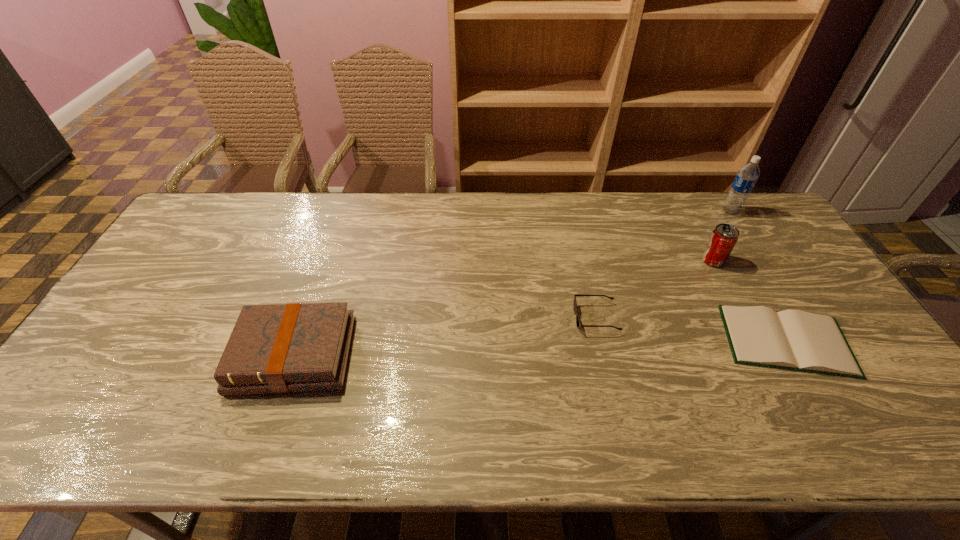
Where is `free area in between the right hardback book and the left hardback book`? free area in between the right hardback book and the left hardback book is located at coordinates [540, 348].

I want to click on empty space between the fourth tallest object and the water bottle, so click(x=663, y=265).

Where is `empty location between the leftmost object and the farthest object`? This screenshot has width=960, height=540. empty location between the leftmost object and the farthest object is located at coordinates (513, 283).

This screenshot has height=540, width=960. I want to click on empty space that is in between the pop soda and the shortest object, so click(x=750, y=300).

Locate an element on the screen. Image resolution: width=960 pixels, height=540 pixels. empty location between the fourth shortest object and the shortest object is located at coordinates (750, 300).

You are a GUI agent. You are given a task and a screenshot of the screen. Output one action in this format:
    pyautogui.click(x=<x>, y=<y>)
    Task: Click on the free space that is in between the sunglasses and the farthest object
    The width and height of the screenshot is (960, 540).
    Given the screenshot: What is the action you would take?
    pyautogui.click(x=663, y=265)

Identify the location of object that is the second closest one to the shortest object. This screenshot has height=540, width=960. (578, 323).

Identify which object is the fourth nearest to the taller hardback book. Please provide its 2D coordinates. Your answer should be formatted as a tuple, i.e. [(x, y)], where the tuple contains the x and y coordinates of a point satisfying the conditions above.

[(746, 178)]

Find the location of a particular element. This screenshot has width=960, height=540. free space in the image that satisfies the following two spatial constraints: 1. on the front lenses of the shortest object; 2. on the right side of the second shortest object is located at coordinates (601, 341).

Find the location of a particular element. Image resolution: width=960 pixels, height=540 pixels. free space that satisfies the following two spatial constraints: 1. on the back side of the shorter hardback book; 2. on the right side of the farthest object is located at coordinates (710, 211).